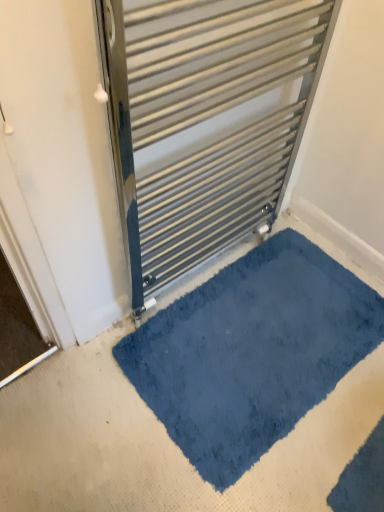
Question: Considering the relative sizes of blue plush bath mat at lower center and metallic silver radiator at center in the image provided, is blue plush bath mat at lower center bigger than metallic silver radiator at center?

Choices:
 (A) yes
 (B) no

Answer: (B)

Question: Does blue plush bath mat at lower center come behind metallic silver radiator at center?

Choices:
 (A) no
 (B) yes

Answer: (B)

Question: Is blue plush bath mat at lower center not close to metallic silver radiator at center?

Choices:
 (A) yes
 (B) no

Answer: (B)

Question: Is blue plush bath mat at lower center facing towards metallic silver radiator at center?

Choices:
 (A) no
 (B) yes

Answer: (A)

Question: Is blue plush bath mat at lower center closer to camera compared to metallic silver radiator at center?

Choices:
 (A) no
 (B) yes

Answer: (A)

Question: From a real-world perspective, is blue plush bath mat at lower center located higher than metallic silver radiator at center?

Choices:
 (A) yes
 (B) no

Answer: (B)

Question: From a real-world perspective, is metallic silver radiator at center positioned under blue plush bath mat at lower center based on gravity?

Choices:
 (A) yes
 (B) no

Answer: (B)

Question: Does metallic silver radiator at center have a greater width compared to blue plush bath mat at lower center?

Choices:
 (A) yes
 (B) no

Answer: (B)

Question: Can you confirm if metallic silver radiator at center is bigger than blue plush bath mat at lower center?

Choices:
 (A) no
 (B) yes

Answer: (B)

Question: Is the depth of metallic silver radiator at center less than that of blue plush bath mat at lower center?

Choices:
 (A) yes
 (B) no

Answer: (A)

Question: Can you confirm if metallic silver radiator at center is positioned to the right of blue plush bath mat at lower center?

Choices:
 (A) no
 (B) yes

Answer: (A)

Question: From a real-world perspective, is metallic silver radiator at center on blue plush bath mat at lower center?

Choices:
 (A) yes
 (B) no

Answer: (A)

Question: Looking at their shapes, would you say blue plush bath mat at lower center is wider or thinner than metallic silver radiator at center?

Choices:
 (A) wide
 (B) thin

Answer: (A)